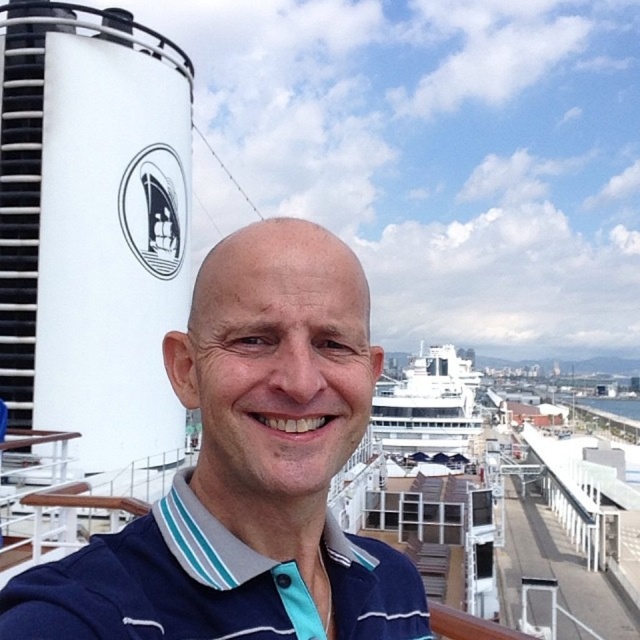
Can you confirm if navy blue polo shirt at center is bigger than white glossy cruise ship at upper center?

No, navy blue polo shirt at center is not bigger than white glossy cruise ship at upper center.

Is point (259, 481) closer to viewer compared to point (381, 406)?

Yes, it is.

Where is `navy blue polo shirt at center`? Image resolution: width=640 pixels, height=640 pixels. navy blue polo shirt at center is located at coordinates (248, 472).

How far apart are navy blue polo shirt at center and navy blue cotton polo shirt at center?

A distance of 34.32 inches exists between navy blue polo shirt at center and navy blue cotton polo shirt at center.

Is navy blue polo shirt at center in front of navy blue cotton polo shirt at center?

No, navy blue polo shirt at center is behind navy blue cotton polo shirt at center.

Is point (260, 486) in front of point (124, 545)?

No, it is behind (124, 545).

The height and width of the screenshot is (640, 640). In order to click on navy blue polo shirt at center in this screenshot , I will do `click(248, 472)`.

Does navy blue cotton polo shirt at center appear on the left side of white glossy cruise ship at upper center?

Indeed, navy blue cotton polo shirt at center is positioned on the left side of white glossy cruise ship at upper center.

Measure the distance between point (250,580) and camera.

Point (250,580) is 7.97 meters from camera.

The height and width of the screenshot is (640, 640). What are the coordinates of `navy blue cotton polo shirt at center` in the screenshot? It's located at [x=161, y=584].